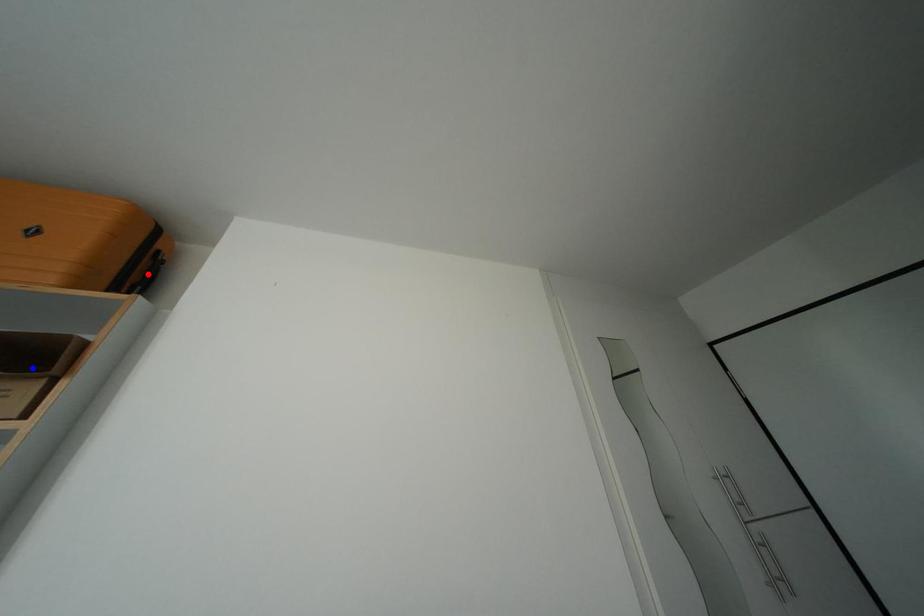
Question: In the image, two points are highlighted. Which point is nearer to the camera? Reply with the corresponding letter.

Choices:
 (A) blue point
 (B) red point

Answer: (A)